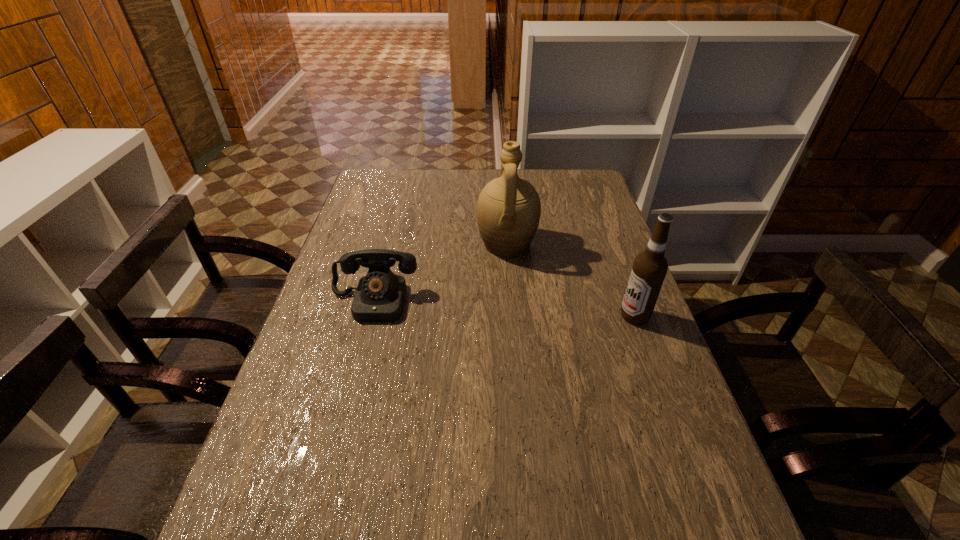
Locate an element on the screen. object that is the closest to the telephone is located at coordinates [508, 211].